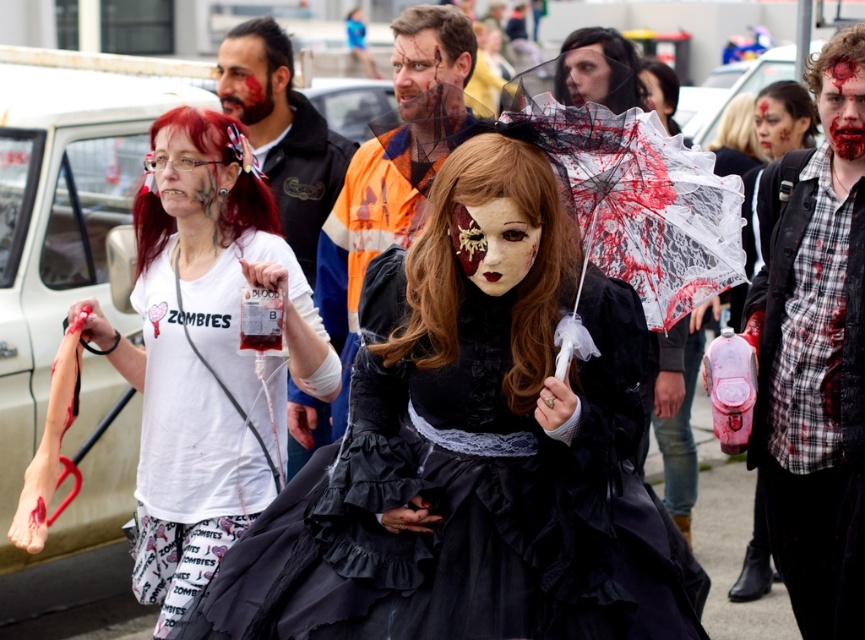
Can you confirm if black satin dress at center is positioned to the right of blood-stained skin at center?

No, black satin dress at center is not to the right of blood-stained skin at center.

Who is positioned more to the right, black satin dress at center or blood-stained skin at center?

blood-stained skin at center

Where is `black satin dress at center`? black satin dress at center is located at coordinates (465, 500).

Is matte black dress at center bigger than blood-stained face at center?

Indeed, matte black dress at center has a larger size compared to blood-stained face at center.

Between matte black dress at center and blood-stained face at center, which one appears on the right side from the viewer's perspective?

Positioned to the right is blood-stained face at center.

Locate an element on the screen. matte black dress at center is located at coordinates (357, 260).

Does plaid fabric shirt at center have a smaller size compared to matte black mask at center?

Incorrect, plaid fabric shirt at center is not smaller in size than matte black mask at center.

Which is more to the right, plaid fabric shirt at center or matte black mask at center?

plaid fabric shirt at center is more to the right.

Which is in front, point (798, 509) or point (516, 257)?

Point (516, 257)

This screenshot has width=865, height=640. I want to click on plaid fabric shirt at center, so click(x=815, y=353).